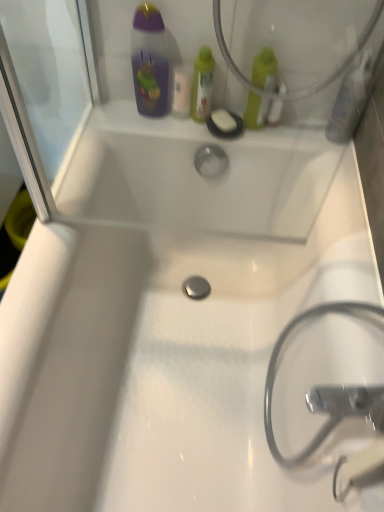
This screenshot has height=512, width=384. I want to click on vacant space in front of translucent plastic mouthwash at upper right, which is the fourth mouthwash from left to right, so click(x=323, y=153).